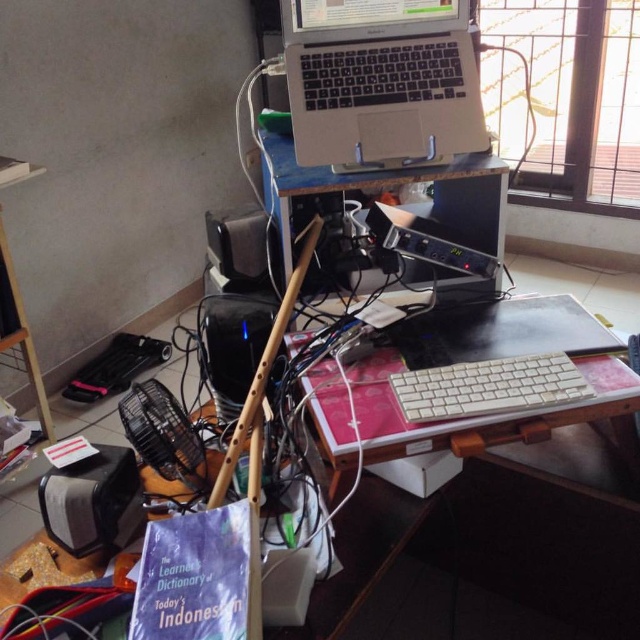
Question: Estimate the real-world distances between objects in this image. Which object is closer to the black plastic speaker at center?

Choices:
 (A) white plastic keyboard at center
 (B) silver metallic laptop at upper center

Answer: (B)

Question: Can you confirm if silver metallic laptop at upper center is wider than black plastic speaker at lower left?

Choices:
 (A) yes
 (B) no

Answer: (A)

Question: Which point appears farthest from the camera in this image?

Choices:
 (A) 144,509
 (B) 577,387

Answer: (A)

Question: Does white plastic keyboard at center appear over black plastic speaker at lower left?

Choices:
 (A) yes
 (B) no

Answer: (A)

Question: Which object is positioned farthest from the black plastic speaker at center?

Choices:
 (A) silver metallic laptop at upper center
 (B) white plastic keyboard at center

Answer: (B)

Question: Is silver metallic laptop at upper center positioned before black plastic speaker at lower left?

Choices:
 (A) no
 (B) yes

Answer: (A)